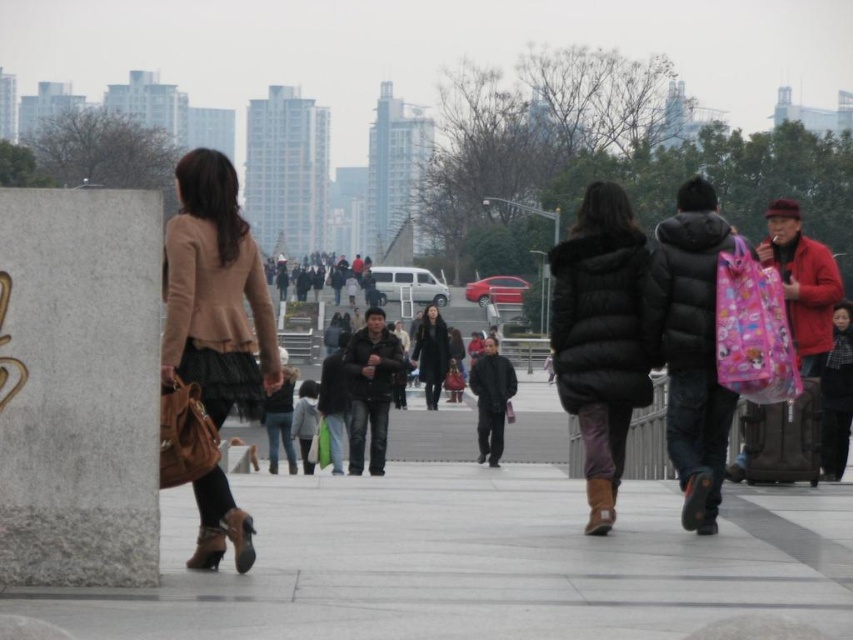
Question: Which of the following is the farthest from the observer?

Choices:
 (A) black fur coat at center
 (B) black leather coat at center

Answer: (B)

Question: Can you confirm if gray concrete pavement at center is positioned above black leather coat at center?

Choices:
 (A) yes
 (B) no

Answer: (B)

Question: Is gray concrete pavement at center behind matte beige coat at left?

Choices:
 (A) no
 (B) yes

Answer: (A)

Question: Does gray concrete pavement at center have a smaller size compared to black leather coat at center?

Choices:
 (A) no
 (B) yes

Answer: (B)

Question: Among these objects, which one is nearest to the camera?

Choices:
 (A) gray concrete pavement at center
 (B) black leather coat at center

Answer: (A)

Question: Considering the real-world distances, which object is farthest from the black leather coat at center?

Choices:
 (A) gray concrete pavement at center
 (B) matte beige coat at left

Answer: (B)